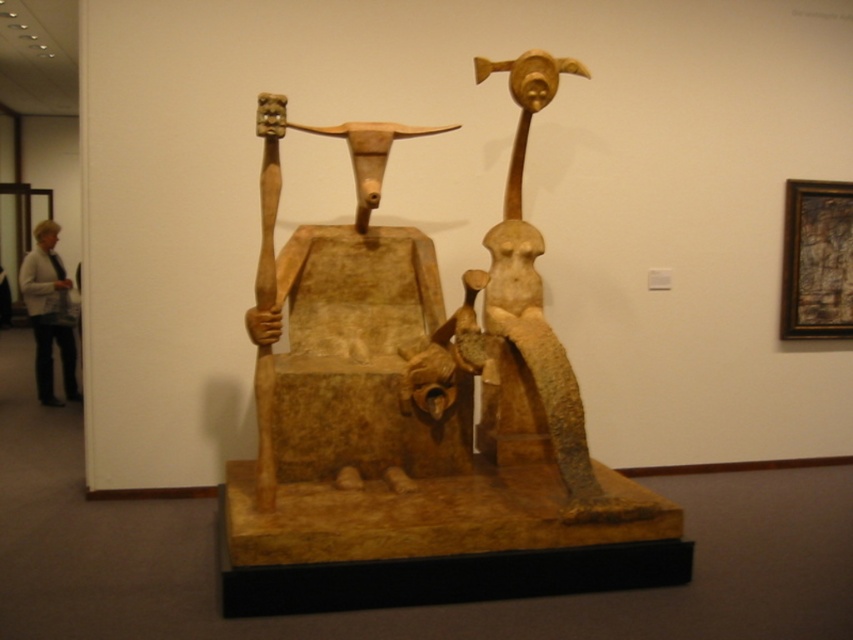
Question: Does matte wood throne at center have a smaller size compared to light beige sweater at left?

Choices:
 (A) no
 (B) yes

Answer: (A)

Question: Which point appears closest to the camera in this image?

Choices:
 (A) (390, 458)
 (B) (39, 314)

Answer: (A)

Question: Is matte wood throne at center wider than light beige sweater at left?

Choices:
 (A) yes
 (B) no

Answer: (A)

Question: Does matte wood throne at center appear on the right side of light beige sweater at left?

Choices:
 (A) yes
 (B) no

Answer: (A)

Question: Which point appears closest to the camera in this image?

Choices:
 (A) (49, 381)
 (B) (329, 474)

Answer: (B)